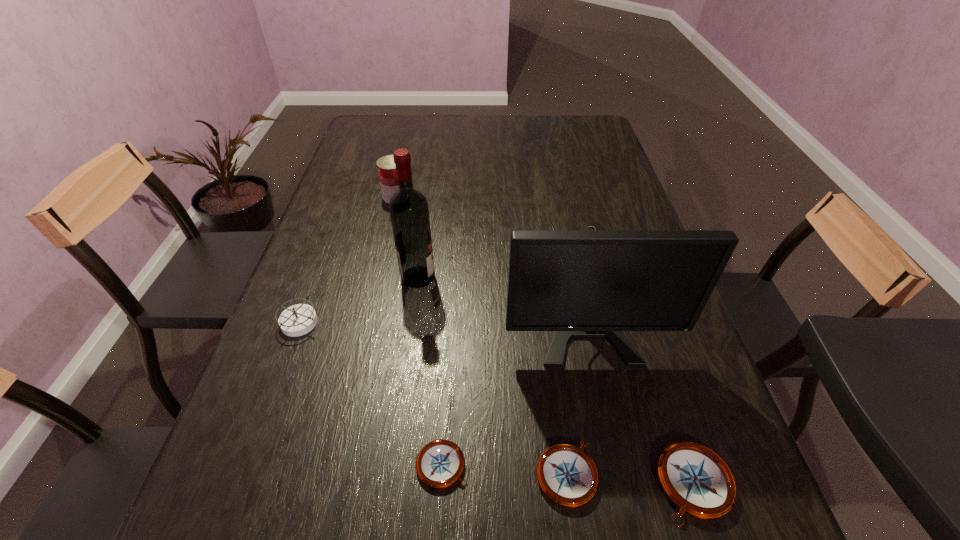
Where is `empty location between the can and the computer monitor`? This screenshot has width=960, height=540. empty location between the can and the computer monitor is located at coordinates (487, 242).

At what (x,y) coordinates should I click in order to perform the action: click on free space between the third compass from left to right and the farthest object. Please return your answer as a coordinate pair (x, y). This screenshot has height=540, width=960. Looking at the image, I should click on (481, 335).

What are the coordinates of `empty location between the second object from left to right and the computer monitor` in the screenshot? It's located at (487, 242).

Where is `vacant area that lies between the alcohol and the third shortest compass`? This screenshot has width=960, height=540. vacant area that lies between the alcohol and the third shortest compass is located at coordinates [556, 380].

Where is `free spot between the third shortest compass and the alcohol`? Image resolution: width=960 pixels, height=540 pixels. free spot between the third shortest compass and the alcohol is located at coordinates (556, 380).

Where is `vacant space that's between the third shortest compass and the farthest object`? This screenshot has width=960, height=540. vacant space that's between the third shortest compass and the farthest object is located at coordinates (545, 340).

You are a GUI agent. You are given a task and a screenshot of the screen. Output one action in this format:
    pyautogui.click(x=<x>, y=<y>)
    Task: Click on the free space between the third tallest object and the second compass from left to right
    This screenshot has width=960, height=540.
    Given the screenshot: What is the action you would take?
    pyautogui.click(x=419, y=330)

Find the location of a particular element. The width and height of the screenshot is (960, 540). the closest object to the farthest object is located at coordinates (409, 212).

This screenshot has width=960, height=540. Find the location of `object that is the fifth closest to the tallest compass`. object that is the fifth closest to the tallest compass is located at coordinates (567, 475).

Locate which compass ranks in proximity to the third tallest compass. Please provide its 2D coordinates. Your answer should be formatted as a tuple, i.e. [(x, y)], where the tuple contains the x and y coordinates of a point satisfying the conditions above.

[(697, 480)]